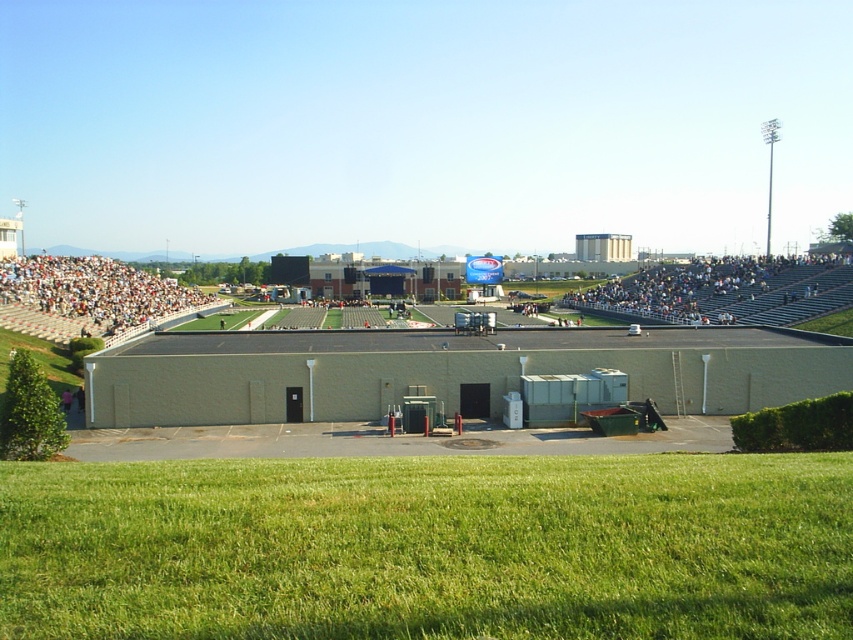
You are a groundskeeper who needs to mow the green grass at lower center. You have a lawnmower that can only travel 60 meters before needing a recharge. Can you reach the white plastic seats at left without recharging your lawnmower?

The distance between the green grass at lower center and the white plastic seats at left is 61.71 meters. Since the lawnmower can only travel 60 meters before needing a recharge, you cannot reach the white plastic seats at left without recharging.